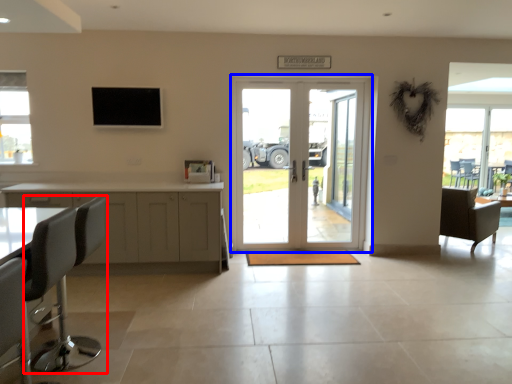
Question: Which point is closer to the camera, chair (highlighted by a red box) or door (highlighted by a blue box)?

Choices:
 (A) chair
 (B) door

Answer: (A)